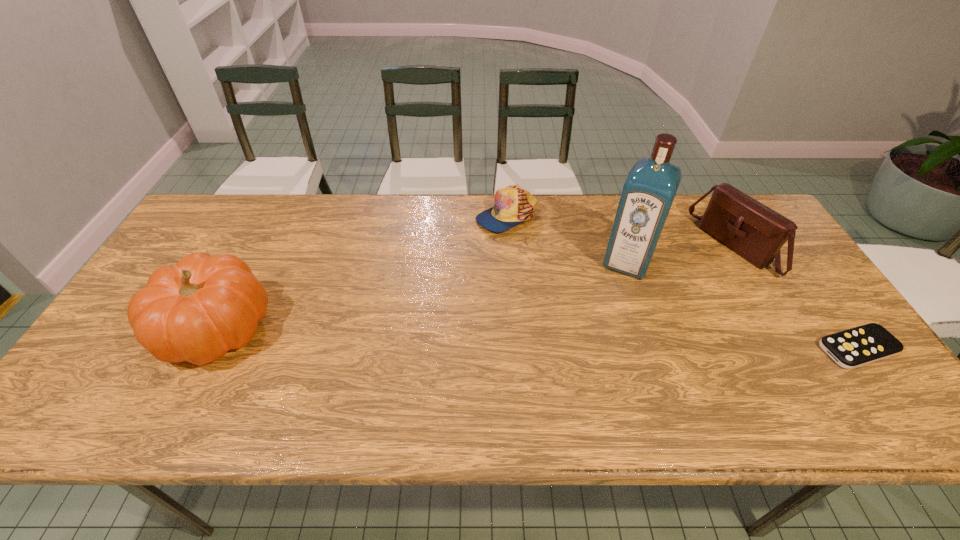
This screenshot has width=960, height=540. What are the coordinates of `free region located 0.250m on the flat label side of the liquor` in the screenshot? It's located at (591, 345).

This screenshot has height=540, width=960. I want to click on vacant space located on the flat label side of the liquor, so click(x=581, y=369).

Identify the location of free space located 0.320m on the flat label side of the liquor. (582, 366).

Identify the location of vacant space positioned 0.280m on the front flap of the third shortest object. The image size is (960, 540). (x=645, y=305).

Where is `blank space located 0.180m on the front flap of the third shortest object`? The width and height of the screenshot is (960, 540). blank space located 0.180m on the front flap of the third shortest object is located at coordinates (672, 289).

You are a GUI agent. You are given a task and a screenshot of the screen. Output one action in this format:
    pyautogui.click(x=<x>, y=<y>)
    Task: Click on the vacant space located 0.080m on the front flap of the third shortest object
    The width and height of the screenshot is (960, 540).
    Given the screenshot: What is the action you would take?
    pyautogui.click(x=696, y=276)

Where is `vacant region located 0.280m on the bill of the second object from left to right`? The width and height of the screenshot is (960, 540). vacant region located 0.280m on the bill of the second object from left to right is located at coordinates (458, 299).

Where is `vacant space situated on the bill of the second object from left to right`? The height and width of the screenshot is (540, 960). vacant space situated on the bill of the second object from left to right is located at coordinates (485, 254).

This screenshot has width=960, height=540. In order to click on free spot located on the bill of the second object from left to right in this screenshot , I will do `click(461, 293)`.

Where is `shoulder bag at the far edge`? The image size is (960, 540). shoulder bag at the far edge is located at coordinates (751, 229).